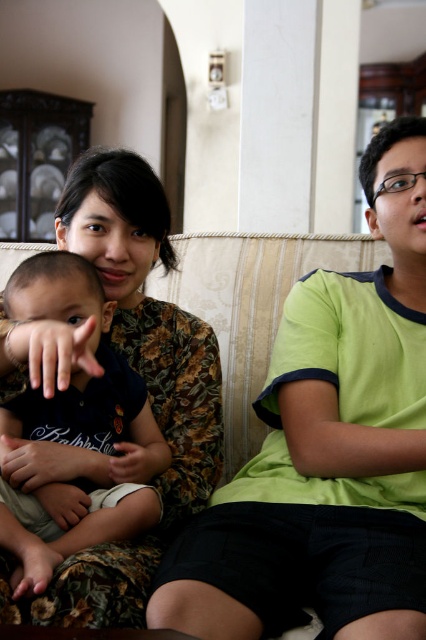
You are standing in the living room and want to place a small decorative item exactly at the point marked as point (88, 451). If your arm can reach up to 4 feet, can you place the item without moving closer?

The distance of point (88, 451) from viewer is 3.84 feet, so yes, you can place the item since your arm can reach up to 4 feet and the distance is within that range.

You are a furniture delivery person who just arrived at the house. You need to place a new coffee table that is 1.2 meters wide in the living room. Based on the image, can the coffee table fit between the dark blue fabric baby at left and the beige fabric couch at center?

The dark blue fabric baby at left has a lesser width compared to the beige fabric couch at center. Since the coffee table is 1.2 meters wide, it depends on the available space between them. However, the description only provides information about their widths, not the distance between them. Therefore, it is unclear if the coffee table will fit without additional measurements.

You are a photographer setting up a shoot in this living room. You need to position a small prop on the beige fabric couch at center so that it is visible above the dark blue fabric baby at left. Is this possible based on their current positions?

The dark blue fabric baby at left is below the beige fabric couch at center, so placing a prop on the couch would indeed be visible above the baby since the couch is elevated relative to the baby.